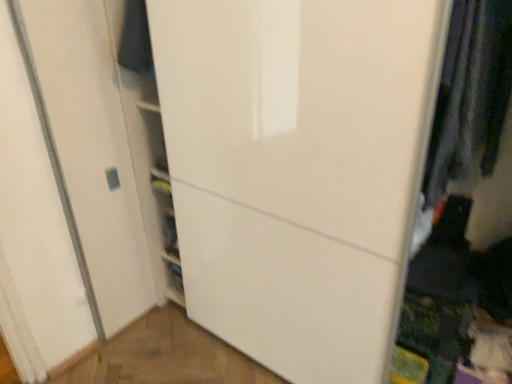
Question: Considering their positions, is dark gray fabric at right, marked as the second clothing in a back-to-front arrangement, located in front of or behind white glossy door at center?

Choices:
 (A) behind
 (B) front

Answer: (A)

Question: Looking at their shapes, would you say dark gray fabric at right, positioned as the 1th clothing in right-to-left order, is wider or thinner than white glossy door at center?

Choices:
 (A) thin
 (B) wide

Answer: (A)

Question: Which is nearer to the white glossy door at center?

Choices:
 (A) dark blue fabric at upper left, which is counted as the first clothing, starting from the left
 (B) dark gray fabric at right, marked as the second clothing in a left-to-right arrangement

Answer: (B)

Question: Which of these objects is positioned farthest from the dark blue fabric at upper left, positioned as the 2th clothing in front-to-back order?

Choices:
 (A) white glossy door at center
 (B) dark gray fabric at right, marked as the second clothing in a left-to-right arrangement

Answer: (B)